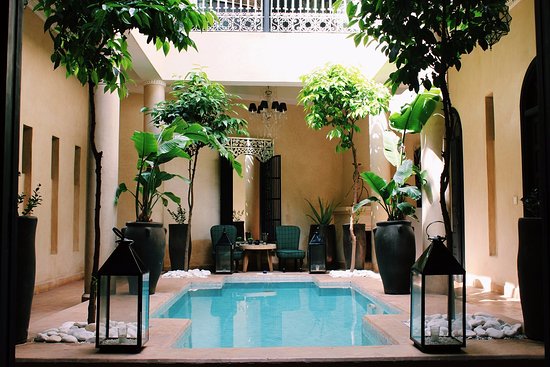
Where is `door side left`? This screenshot has height=367, width=550. door side left is located at coordinates (224, 184).